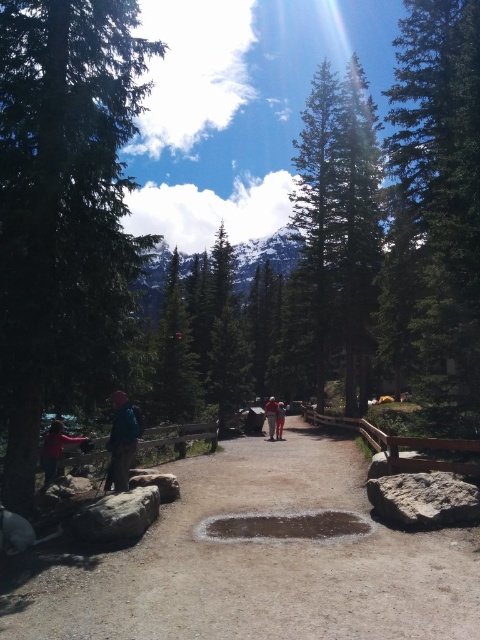
Which is below, dirt path at center or orange fabric jacket at center?

orange fabric jacket at center

Is dirt path at center above orange fabric jacket at center?

Yes, dirt path at center is above orange fabric jacket at center.

At what (x,y) coordinates should I click in order to perform the action: click on dirt path at center. Please return your answer as a coordinate pair (x, y). Image resolution: width=480 pixels, height=640 pixels. Looking at the image, I should click on (262, 563).

Who is more distant from viewer, (420, 22) or (130, 408)?

The point (420, 22) is behind.

Identify the location of green textured tree at right. The image size is (480, 640). (442, 193).

At what (x,y) coordinates should I click in order to perform the action: click on green textured tree at right. Please return your answer as a coordinate pair (x, y). Image resolution: width=480 pixels, height=640 pixels. Looking at the image, I should click on coord(442,193).

Between green textured tree at right and orange fabric jacket at center, which one has less height?

orange fabric jacket at center is shorter.

In the scene shown: Is green textured tree at right thinner than orange fabric jacket at center?

No, green textured tree at right is not thinner than orange fabric jacket at center.

Which is behind, point (468, 179) or point (279, 413)?

The point (279, 413) is behind.

Find the location of a particular element. green textured tree at right is located at coordinates (442, 193).